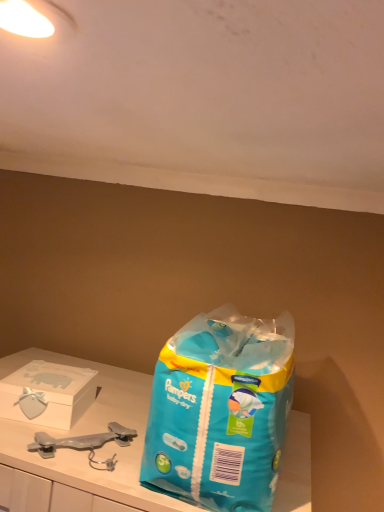
Question: Visually, is blue plastic bag at center positioned to the left or to the right of matte white box at left?

Choices:
 (A) right
 (B) left

Answer: (A)

Question: Is blue plastic bag at center wider or thinner than matte white box at left?

Choices:
 (A) wide
 (B) thin

Answer: (A)

Question: From a real-world perspective, relative to matte white box at left, is blue plastic bag at center vertically above or below?

Choices:
 (A) above
 (B) below

Answer: (A)

Question: Looking at the image, does matte white box at left seem bigger or smaller compared to blue plastic bag at center?

Choices:
 (A) small
 (B) big

Answer: (A)

Question: Looking at their shapes, would you say matte white box at left is wider or thinner than blue plastic bag at center?

Choices:
 (A) wide
 (B) thin

Answer: (B)

Question: From the image's perspective, is matte white box at left positioned above or below blue plastic bag at center?

Choices:
 (A) above
 (B) below

Answer: (B)

Question: Choose the correct answer: Is matte white box at left inside blue plastic bag at center or outside it?

Choices:
 (A) outside
 (B) inside

Answer: (A)